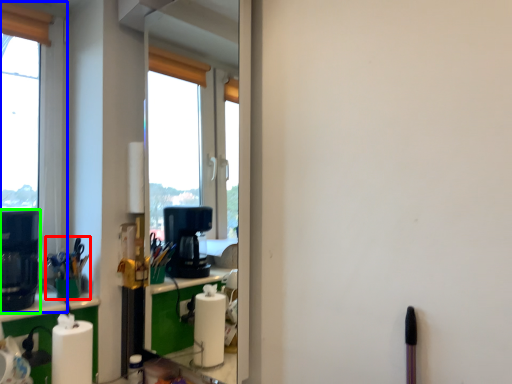
Question: Considering the real-world distances, which object is farthest from stationery (highlighted by a red box)? window (highlighted by a blue box) or coffee machine (highlighted by a green box)?

Choices:
 (A) window
 (B) coffee machine

Answer: (A)